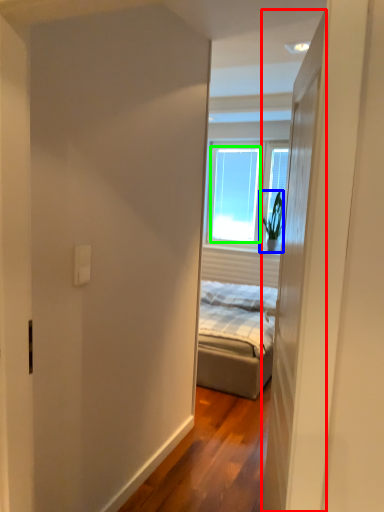
Question: Which object is positioned farthest from door (highlighted by a red box)? Select from houseplant (highlighted by a blue box) and window (highlighted by a green box).

Choices:
 (A) houseplant
 (B) window

Answer: (B)